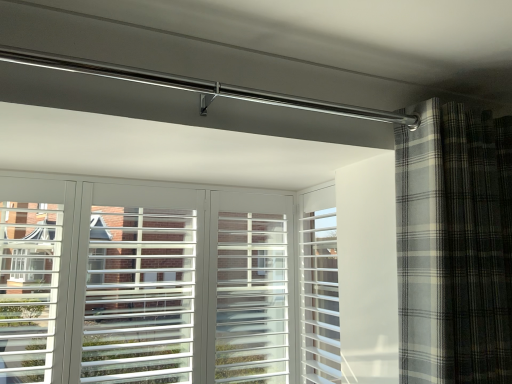
Where is `plaid fabric curtain at right`? The height and width of the screenshot is (384, 512). plaid fabric curtain at right is located at coordinates (454, 246).

The image size is (512, 384). What do you see at coordinates (454, 246) in the screenshot? I see `plaid fabric curtain at right` at bounding box center [454, 246].

Locate an element on the screen. white plastic screen door at center is located at coordinates (320, 288).

Describe the element at coordinates (320, 288) in the screenshot. I see `white plastic screen door at center` at that location.

Identify the location of plaid fabric curtain at right. (454, 246).

Does plaid fabric curtain at right appear on the left side of white plastic screen door at center?

No, plaid fabric curtain at right is not to the left of white plastic screen door at center.

Which object is further away from the camera taking this photo, plaid fabric curtain at right or white plastic screen door at center?

white plastic screen door at center is further from the camera.

Does point (449, 347) appear closer or farther from the camera than point (328, 293)?

Point (449, 347) is closer to the camera than point (328, 293).

From the image's perspective, would you say plaid fabric curtain at right is positioned over white plastic screen door at center?

Yes.

From a real-world perspective, is plaid fabric curtain at right over white plastic screen door at center?

Yes.

Does plaid fabric curtain at right have a lesser width compared to white plastic screen door at center?

Incorrect, the width of plaid fabric curtain at right is not less than that of white plastic screen door at center.

In the scene shown: Considering the sizes of objects plaid fabric curtain at right and white plastic screen door at center in the image provided, who is taller, plaid fabric curtain at right or white plastic screen door at center?

Standing taller between the two is white plastic screen door at center.

In the scene shown: Which of these two, plaid fabric curtain at right or white plastic screen door at center, is bigger?

plaid fabric curtain at right.

Is plaid fabric curtain at right positioned beyond the bounds of white plastic screen door at center?

plaid fabric curtain at right lies outside white plastic screen door at center's area.

Are plaid fabric curtain at right and white plastic screen door at center far apart?

plaid fabric curtain at right is near white plastic screen door at center, not far away.

Is white plastic screen door at center at the back of plaid fabric curtain at right?

Yes.

How many degrees apart are the facing directions of plaid fabric curtain at right and white plastic screen door at center?

The angle between the facing direction of plaid fabric curtain at right and the facing direction of white plastic screen door at center is 87.5 degrees.

Where is `screen door located underneath the plaid fabric curtain at right (from a real-world perspective)`? screen door located underneath the plaid fabric curtain at right (from a real-world perspective) is located at coordinates (320, 288).

Considering the positions of objects white plastic screen door at center and plaid fabric curtain at right in the image provided, who is more to the right, white plastic screen door at center or plaid fabric curtain at right?

From the viewer's perspective, plaid fabric curtain at right appears more on the right side.

Which object is further away from the camera, white plastic screen door at center or plaid fabric curtain at right?

white plastic screen door at center is behind.

Considering the points (322, 306) and (396, 190), which point is behind, point (322, 306) or point (396, 190)?

The point (322, 306) is farther.

From the image's perspective, which object appears higher, white plastic screen door at center or plaid fabric curtain at right?

From the image's view, plaid fabric curtain at right is above.

From a real-world perspective, is white plastic screen door at center positioned above or below plaid fabric curtain at right?

white plastic screen door at center is below plaid fabric curtain at right.

Which object is wider, white plastic screen door at center or plaid fabric curtain at right?

With larger width is plaid fabric curtain at right.

Can you confirm if white plastic screen door at center is taller than plaid fabric curtain at right?

Correct, white plastic screen door at center is much taller as plaid fabric curtain at right.

Considering the relative sizes of white plastic screen door at center and plaid fabric curtain at right in the image provided, is white plastic screen door at center bigger than plaid fabric curtain at right?

Actually, white plastic screen door at center might be smaller than plaid fabric curtain at right.

Which is correct: white plastic screen door at center is inside plaid fabric curtain at right, or outside of it?

white plastic screen door at center is not enclosed by plaid fabric curtain at right.

Is there a large distance between white plastic screen door at center and plaid fabric curtain at right?

No, white plastic screen door at center is not far from plaid fabric curtain at right.

Is white plastic screen door at center turned away from plaid fabric curtain at right?

No, white plastic screen door at center is not facing the opposite direction of plaid fabric curtain at right.

Locate an element on the screen. Image resolution: width=512 pixels, height=384 pixels. curtain above the white plastic screen door at center (from the image's perspective) is located at coordinates (454, 246).

What are the coordinates of `screen door lying below the plaid fabric curtain at right (from the image's perspective)` in the screenshot? It's located at (320, 288).

Where is `curtain that appears above the white plastic screen door at center (from the image's perspective)`? The width and height of the screenshot is (512, 384). curtain that appears above the white plastic screen door at center (from the image's perspective) is located at coordinates 454,246.